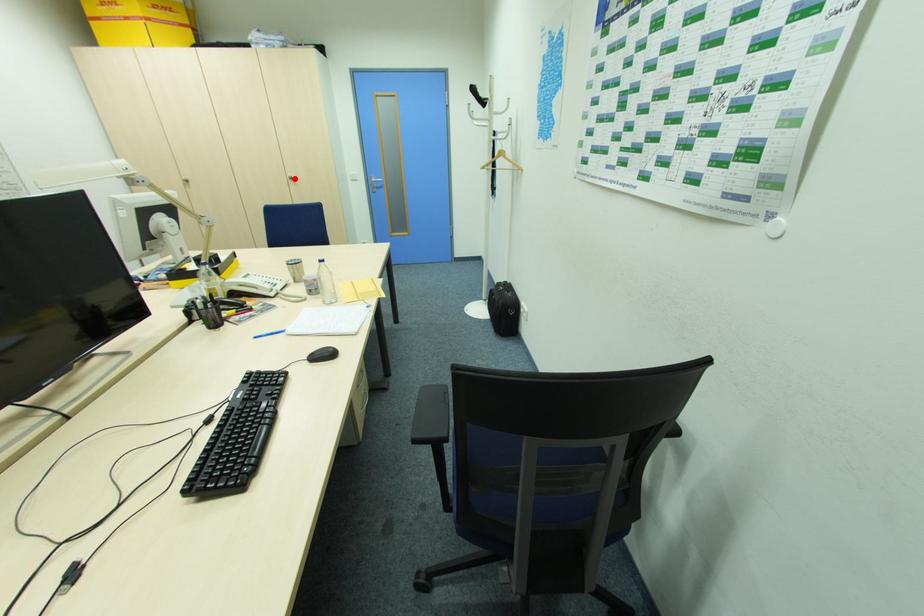
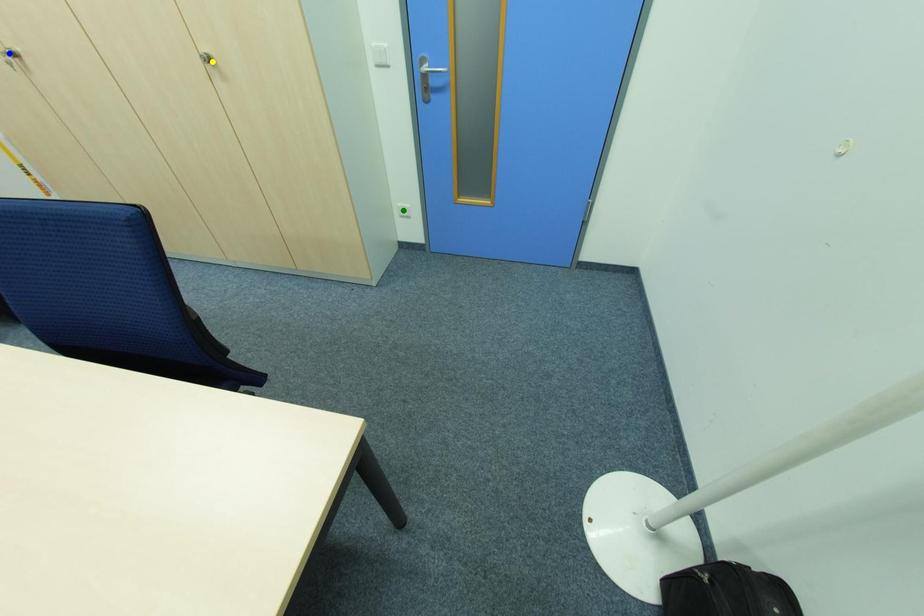
Question: I am providing you with two images of the same scene from different viewpoints. A red point is marked on the first image. You are given multiple points on the second image. Which point in image 2 represents the same 3d spot as the red point in image 1?

Choices:
 (A) yellow point
 (B) blue point
 (C) green point

Answer: (A)